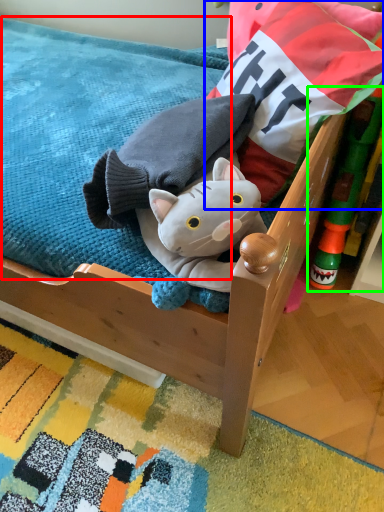
Question: Considering the real-world distances, which object is farthest from mattress (highlighted by a red box)? pillow (highlighted by a blue box) or toy (highlighted by a green box)?

Choices:
 (A) pillow
 (B) toy

Answer: (B)